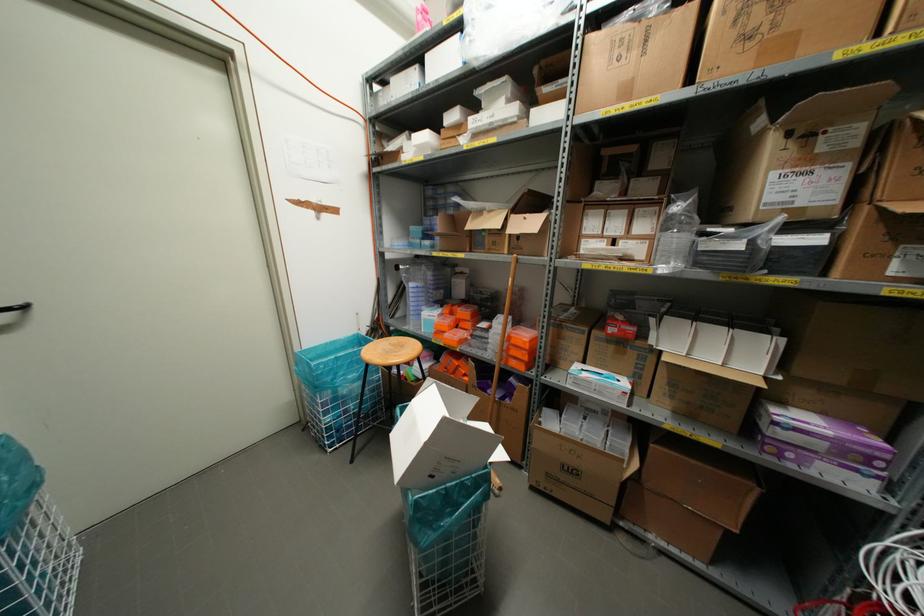
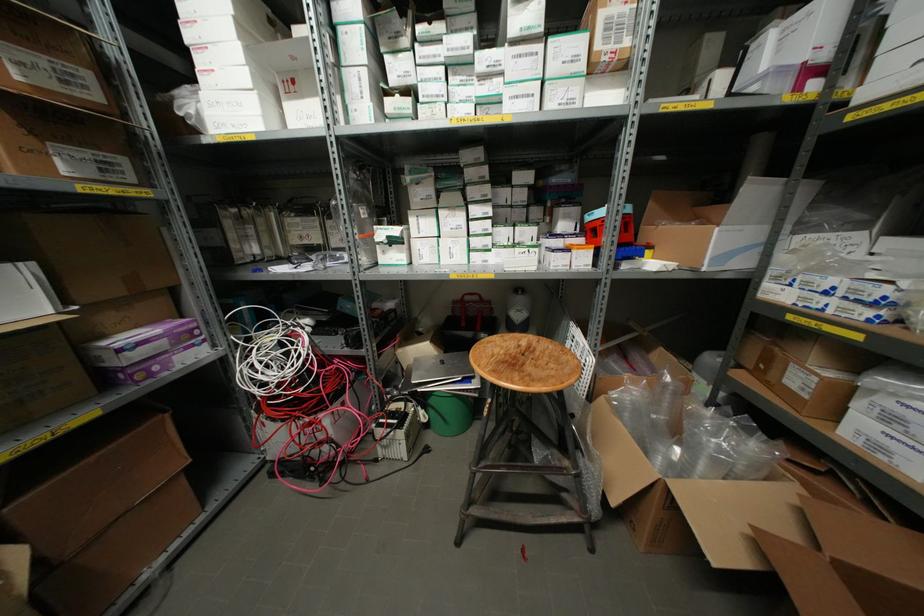
Find the pixel in the second image that matches point 822,444 in the first image.

(163, 342)